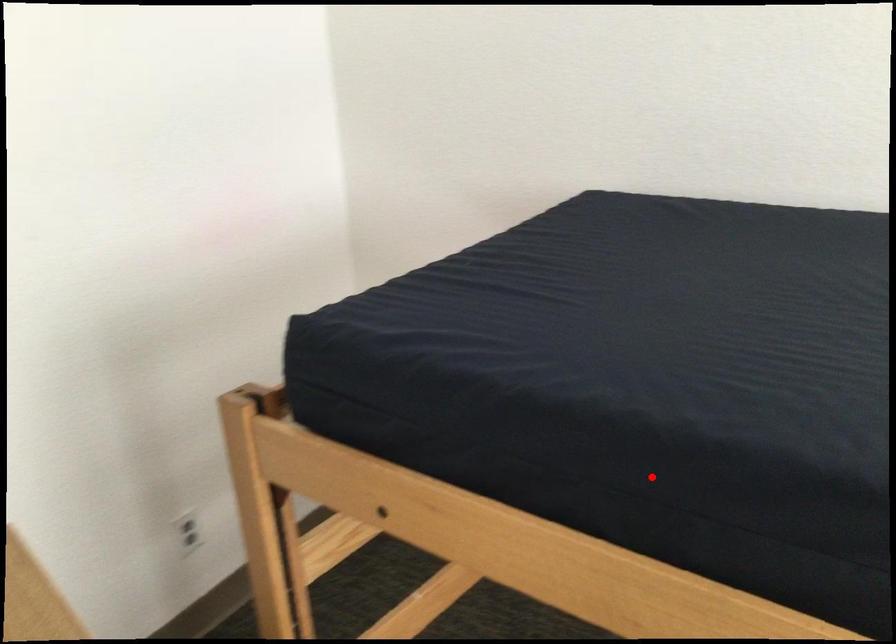
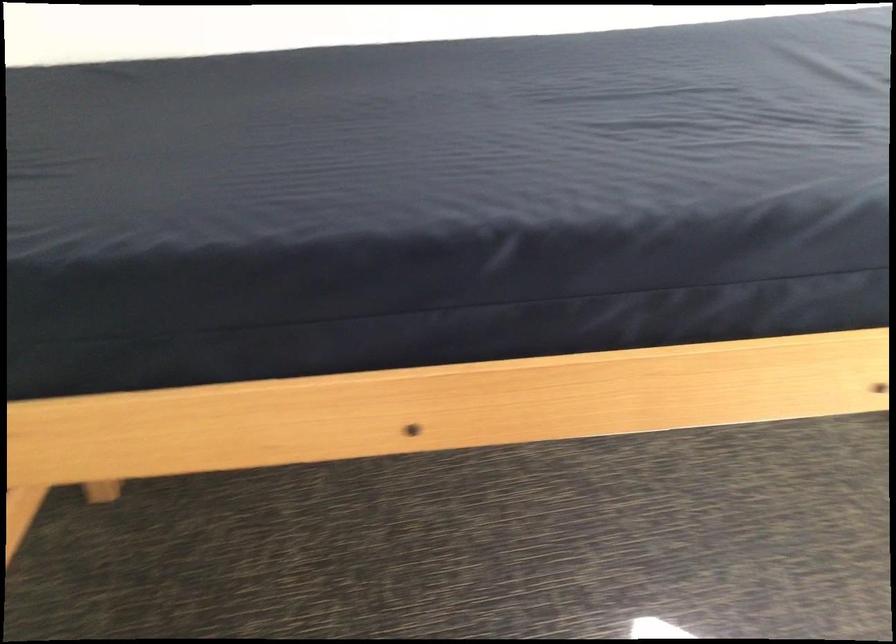
Question: I am providing you with two images of the same scene from different viewpoints. A red point is marked on the first image. Is the red point's position out of view in image 2?

Choices:
 (A) Yes
 (B) No

Answer: (B)